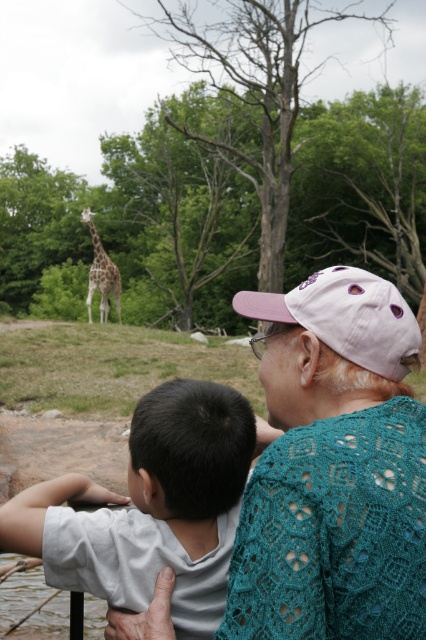
Find the location of a particular element. The image size is (426, 640). white matte shirt at upper left is located at coordinates (150, 508).

Is white matte shirt at upper left in front of spotted fur giraffe at upper left?

Yes, it is in front of spotted fur giraffe at upper left.

Is point (106, 586) less distant than point (112, 289)?

Yes, it is in front of point (112, 289).

This screenshot has height=640, width=426. What are the coordinates of `white matte shirt at upper left` in the screenshot? It's located at (150, 508).

Does pink fabric baseball cap at center lie in front of spotted fur giraffe at upper left?

Yes, it is.

Does pink fabric baseball cap at center have a lesser width compared to spotted fur giraffe at upper left?

Indeed, pink fabric baseball cap at center has a lesser width compared to spotted fur giraffe at upper left.

Which is in front, point (354, 296) or point (94, 269)?

Point (354, 296) is more forward.

Where is `pink fabric baseball cap at center`? pink fabric baseball cap at center is located at coordinates (345, 316).

Does white matte shirt at upper left lie behind pink fabric baseball cap at center?

Yes, white matte shirt at upper left is behind pink fabric baseball cap at center.

The image size is (426, 640). I want to click on white matte shirt at upper left, so click(150, 508).

Is point (222, 579) farther from camera compared to point (348, 291)?

Yes.

Locate an element on the screen. The height and width of the screenshot is (640, 426). white matte shirt at upper left is located at coordinates coord(150,508).